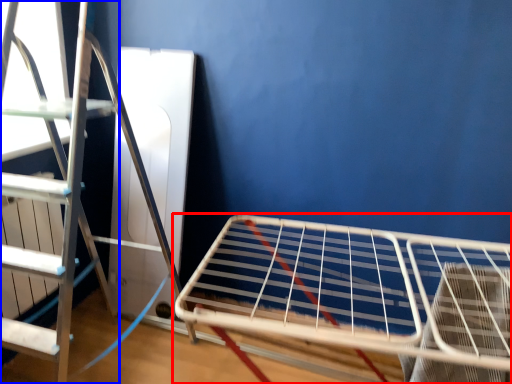
Question: Which point is closer to the camera, furniture (highlighted by a red box) or ladder (highlighted by a blue box)?

Choices:
 (A) furniture
 (B) ladder

Answer: (A)